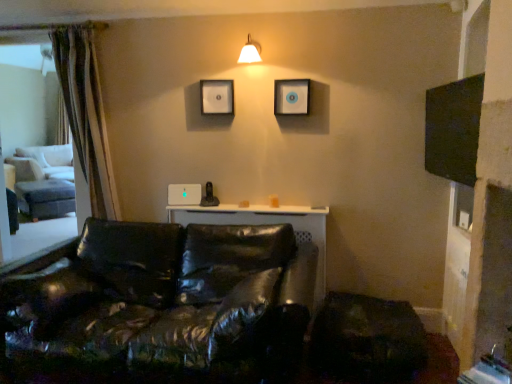
What do you see at coordinates (453, 129) in the screenshot? I see `black matte screen at upper right` at bounding box center [453, 129].

The image size is (512, 384). Describe the element at coordinates (250, 52) in the screenshot. I see `white glossy wall lamp at upper center` at that location.

At what (x,y) coordinates should I click in order to perform the action: click on matte black picture frame at upper center, the 2th picture frame positioned from the right. Please return your answer as a coordinate pair (x, y). The image size is (512, 384). Looking at the image, I should click on (217, 97).

Where is `matte black picture frame at upper center, placed as the second picture frame when sorted from left to right`? The height and width of the screenshot is (384, 512). matte black picture frame at upper center, placed as the second picture frame when sorted from left to right is located at coordinates (291, 97).

The width and height of the screenshot is (512, 384). Describe the element at coordinates (291, 97) in the screenshot. I see `matte black picture frame at upper center, placed as the second picture frame when sorted from left to right` at that location.

You are a GUI agent. You are given a task and a screenshot of the screen. Output one action in this format:
    pyautogui.click(x=<x>, y=<y>)
    Task: Click on the brown textured curtain at left
    This screenshot has height=384, width=512.
    Given the screenshot: What is the action you would take?
    pyautogui.click(x=86, y=114)

Locate an element on the screen. Image resolution: width=512 pixels, height=384 pixels. black matte screen at upper right is located at coordinates (453, 129).

Can you tell me how much black leather couch at lower left and brown textured curtain at left differ in facing direction?

The facing directions of black leather couch at lower left and brown textured curtain at left are 0.586 degrees apart.

Find the location of `curtain behind the black leather couch at lower left`. curtain behind the black leather couch at lower left is located at coordinates (86, 114).

Looking at this image, is black leather couch at lower left surrounding brown textured curtain at left?

Actually, brown textured curtain at left is outside black leather couch at lower left.

Looking at the image, does black leather couch at lower left seem bigger or smaller compared to brown textured curtain at left?

black leather couch at lower left is bigger than brown textured curtain at left.

From a real-world perspective, which object rests below the other?

black leather couch at lower left.

Is white glossy wall lamp at upper center in front of or behind black leather couch at lower left in the image?

white glossy wall lamp at upper center is behind black leather couch at lower left.

Is white glossy wall lamp at upper center beside black leather couch at lower left?

No, white glossy wall lamp at upper center is not next to black leather couch at lower left.

Is white glossy wall lamp at upper center to the left of black leather couch at lower left from the viewer's perspective?

In fact, white glossy wall lamp at upper center is to the right of black leather couch at lower left.

Is black matte screen at upper right situated inside white glossy wall lamp at upper center or outside?

The correct answer is: outside.

From a real-world perspective, is black matte screen at upper right over white glossy wall lamp at upper center?

No.

Is black matte screen at upper right at the right side of brown textured curtain at left?

Indeed, black matte screen at upper right is positioned on the right side of brown textured curtain at left.

From the image's perspective, is black matte screen at upper right on top of brown textured curtain at left?

No, from the image's perspective, black matte screen at upper right is not on top of brown textured curtain at left.

Does black matte screen at upper right have a lesser height compared to brown textured curtain at left?

Correct, black matte screen at upper right is not as tall as brown textured curtain at left.

From a real-world perspective, does black matte screen at upper right sit lower than brown textured curtain at left?

No, from a real-world perspective, black matte screen at upper right is not under brown textured curtain at left.

Based on the photo, from the image's perspective, is white glossy wall lamp at upper center positioned above or below matte black picture frame at upper center, placed as the second picture frame when sorted from left to right?

From the image's perspective, white glossy wall lamp at upper center appears above matte black picture frame at upper center, placed as the second picture frame when sorted from left to right.

Which object is more forward, white glossy wall lamp at upper center or matte black picture frame at upper center, which is the 1th picture frame in right-to-left order?

Positioned in front is white glossy wall lamp at upper center.

Which is more to the left, white glossy wall lamp at upper center or matte black picture frame at upper center, placed as the second picture frame when sorted from left to right?

white glossy wall lamp at upper center is more to the left.

Which is correct: white glossy wall lamp at upper center is inside matte black picture frame at upper center, which is the 1th picture frame in right-to-left order, or outside of it?

white glossy wall lamp at upper center exists outside the volume of matte black picture frame at upper center, which is the 1th picture frame in right-to-left order.

How many degrees apart are the facing directions of matte black picture frame at upper center, the 2th picture frame positioned from the right, and black matte screen at upper right?

88.9 degrees separate the facing orientations of matte black picture frame at upper center, the 2th picture frame positioned from the right, and black matte screen at upper right.

Is black matte screen at upper right a part of matte black picture frame at upper center, arranged as the 1th picture frame when viewed from the left?

No, black matte screen at upper right is located outside of matte black picture frame at upper center, arranged as the 1th picture frame when viewed from the left.

Is the depth of matte black picture frame at upper center, the 2th picture frame positioned from the right, greater than that of black matte screen at upper right?

Yes, matte black picture frame at upper center, the 2th picture frame positioned from the right, is further from the camera.

Can you confirm if black leather couch at lower left is wider than white glossy wall lamp at upper center?

Yes, black leather couch at lower left is wider than white glossy wall lamp at upper center.

Which is more to the right, black leather couch at lower left or white glossy wall lamp at upper center?

white glossy wall lamp at upper center.

Identify the location of studio couch in front of the white glossy wall lamp at upper center. (159, 306).

Locate an element on the screen. This screenshot has height=384, width=512. curtain above the black leather couch at lower left (from the image's perspective) is located at coordinates (86, 114).

I want to click on studio couch that appears on the left of white glossy wall lamp at upper center, so click(x=159, y=306).

When comparing their distances from black matte screen at upper right, does brown textured curtain at left or white glossy wall lamp at upper center seem further?

brown textured curtain at left.

Considering their positions, is matte black picture frame at upper center, the 2th picture frame positioned from the right, positioned closer to black matte screen at upper right than brown textured curtain at left?

The object closer to black matte screen at upper right is matte black picture frame at upper center, the 2th picture frame positioned from the right.

Looking at the image, which one is located closer to matte black picture frame at upper center, the 2th picture frame positioned from the right, black leather couch at lower left or white glossy wall lamp at upper center?

white glossy wall lamp at upper center is closer to matte black picture frame at upper center, the 2th picture frame positioned from the right.

Estimate the real-world distances between objects in this image. Which object is closer to black leather couch at lower left, brown textured curtain at left or black matte screen at upper right?

brown textured curtain at left is closer to black leather couch at lower left.

Estimate the real-world distances between objects in this image. Which object is closer to matte black picture frame at upper center, arranged as the 1th picture frame when viewed from the left, white glossy wall lamp at upper center or matte black picture frame at upper center, which is the 1th picture frame in right-to-left order?

Among the two, white glossy wall lamp at upper center is located nearer to matte black picture frame at upper center, arranged as the 1th picture frame when viewed from the left.

Which object lies further to the anchor point black matte screen at upper right, matte black picture frame at upper center, arranged as the 1th picture frame when viewed from the left, or white glossy wall lamp at upper center?

The object further to black matte screen at upper right is matte black picture frame at upper center, arranged as the 1th picture frame when viewed from the left.

From the image, which object appears to be nearer to matte black picture frame at upper center, which is the 1th picture frame in right-to-left order, black matte screen at upper right or white glossy wall lamp at upper center?

Among the two, white glossy wall lamp at upper center is located nearer to matte black picture frame at upper center, which is the 1th picture frame in right-to-left order.

From the image, which object appears to be nearer to matte black picture frame at upper center, arranged as the 1th picture frame when viewed from the left, matte black picture frame at upper center, placed as the second picture frame when sorted from left to right, or brown textured curtain at left?

Based on the image, matte black picture frame at upper center, placed as the second picture frame when sorted from left to right, appears to be nearer to matte black picture frame at upper center, arranged as the 1th picture frame when viewed from the left.

What are the coordinates of `picture frame situated between white glossy wall lamp at upper center and black matte screen at upper right from left to right` in the screenshot? It's located at (291, 97).

In order to click on picture frame between matte black picture frame at upper center, the 2th picture frame positioned from the right, and black matte screen at upper right, in the horizontal direction in this screenshot , I will do `click(291, 97)`.

Identify the location of picture frame between brown textured curtain at left and matte black picture frame at upper center, placed as the second picture frame when sorted from left to right, from left to right. (217, 97).

The height and width of the screenshot is (384, 512). Identify the location of light fixture situated between black leather couch at lower left and black matte screen at upper right from left to right. (250, 52).